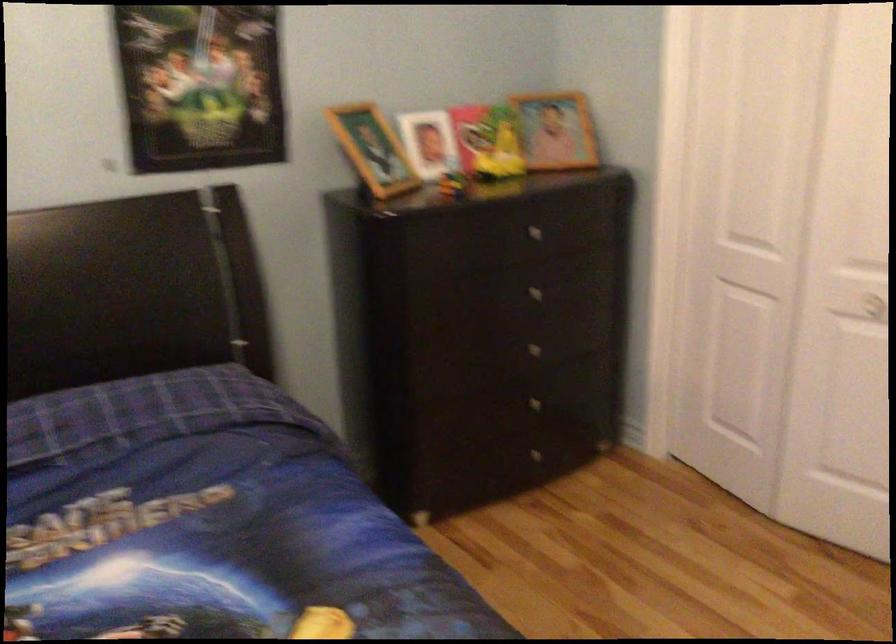
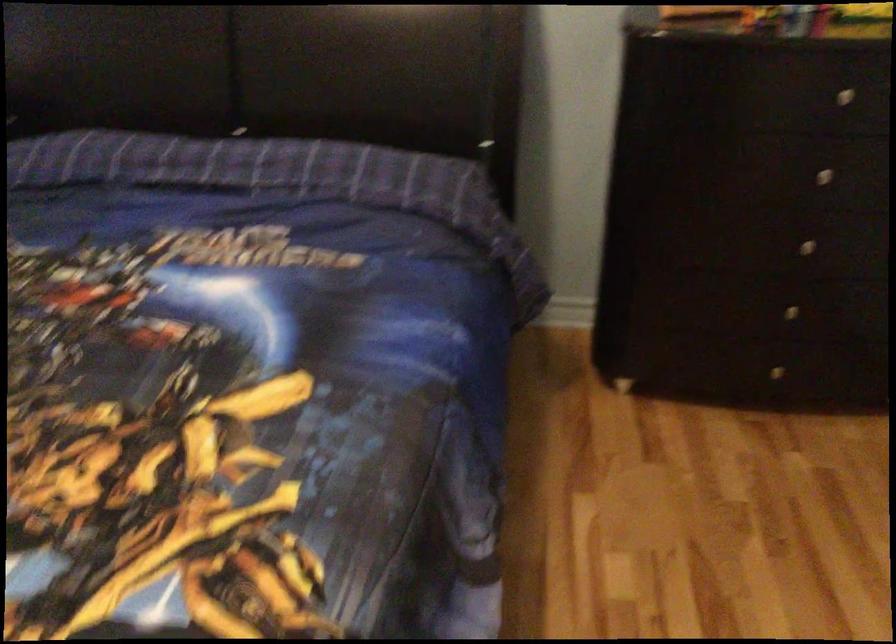
The point at (540, 225) is marked in the first image. Where is the corresponding point in the second image?

(858, 91)